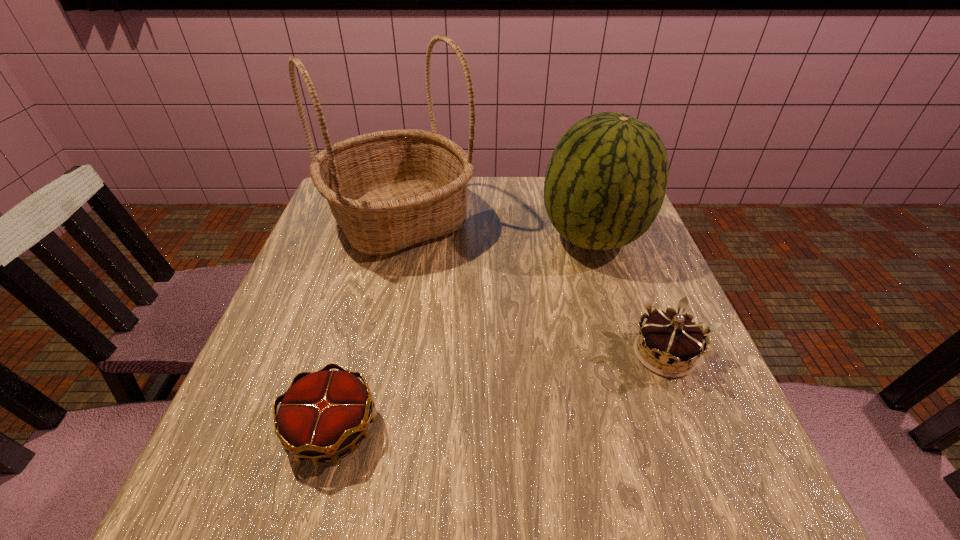
Where is `basket that is at the far edge`? The width and height of the screenshot is (960, 540). basket that is at the far edge is located at coordinates (388, 190).

At what (x,y) coordinates should I click in order to perform the action: click on watermelon at the far edge. Please return your answer as a coordinate pair (x, y). This screenshot has width=960, height=540. Looking at the image, I should click on (605, 183).

Where is `object located in the near edge section of the desktop`? The width and height of the screenshot is (960, 540). object located in the near edge section of the desktop is located at coordinates (323, 413).

At what (x,y) coordinates should I click in order to perform the action: click on basket at the left edge. Please return your answer as a coordinate pair (x, y). The height and width of the screenshot is (540, 960). Looking at the image, I should click on (388, 190).

At what (x,y) coordinates should I click in order to perform the action: click on crown positioned at the left edge. Please return your answer as a coordinate pair (x, y). The width and height of the screenshot is (960, 540). Looking at the image, I should click on (323, 413).

Where is `watermelon that is at the right edge`? This screenshot has height=540, width=960. watermelon that is at the right edge is located at coordinates (605, 183).

Where is `crown present at the right edge`? The height and width of the screenshot is (540, 960). crown present at the right edge is located at coordinates (671, 337).

Image resolution: width=960 pixels, height=540 pixels. Identify the location of object that is positioned at the far left corner. (388, 190).

What are the coordinates of `object situated at the near left corner` in the screenshot? It's located at (323, 413).

This screenshot has height=540, width=960. In order to click on object that is at the far right corner in this screenshot , I will do `click(605, 183)`.